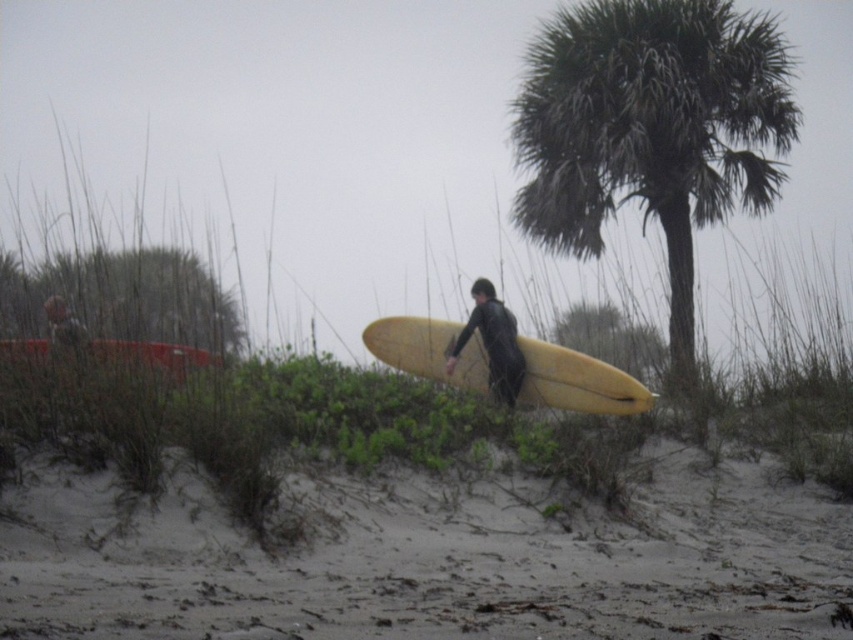
You are standing at the beach and want to place a small flag exactly halfway between point (697, 145) and point (141, 358). Will the flag be closer to the camera or further away compared to the midpoint between these two points?

The flag placed exactly halfway between point (697, 145) and point (141, 358) will be closer to the camera than the midpoint because point (697, 145) is closer to the camera than point (141, 358).

Consider the image. You are a photographer trying to capture the matte black wetsuit at center and the green leafy palm tree at upper right in a single frame. Based on their sizes, which object would appear smaller in the photo?

The green leafy palm tree at upper right would appear smaller in the photo because it has a lesser width compared to the matte black wetsuit at center.